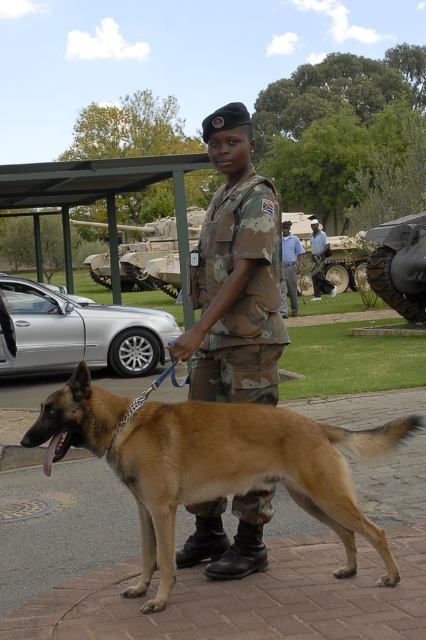
Which is in front, point (98, 330) or point (291, 291)?

Point (98, 330)

Describe the element at coordinates (77, 332) in the screenshot. I see `silver metallic car at left` at that location.

Locate an element on the screen. Image resolution: width=426 pixels, height=640 pixels. silver metallic car at left is located at coordinates (77, 332).

Is point (195, 225) positioned behind point (293, 272)?

Yes, it is behind point (293, 272).

Between camouflage paint tank at center and blue shirt at center, which one has less height?

blue shirt at center is shorter.

Which is in front, point (164, 218) or point (284, 316)?

Point (284, 316)

This screenshot has height=640, width=426. What are the coordinates of `camouflage paint tank at center` in the screenshot? It's located at (149, 257).

Is silver metallic car at left thinner than camouflage uniform at center?

No.

Based on the photo, can you confirm if silver metallic car at left is positioned to the right of camouflage uniform at center?

In fact, silver metallic car at left is to the left of camouflage uniform at center.

Find the location of a particular element. silver metallic car at left is located at coordinates (77, 332).